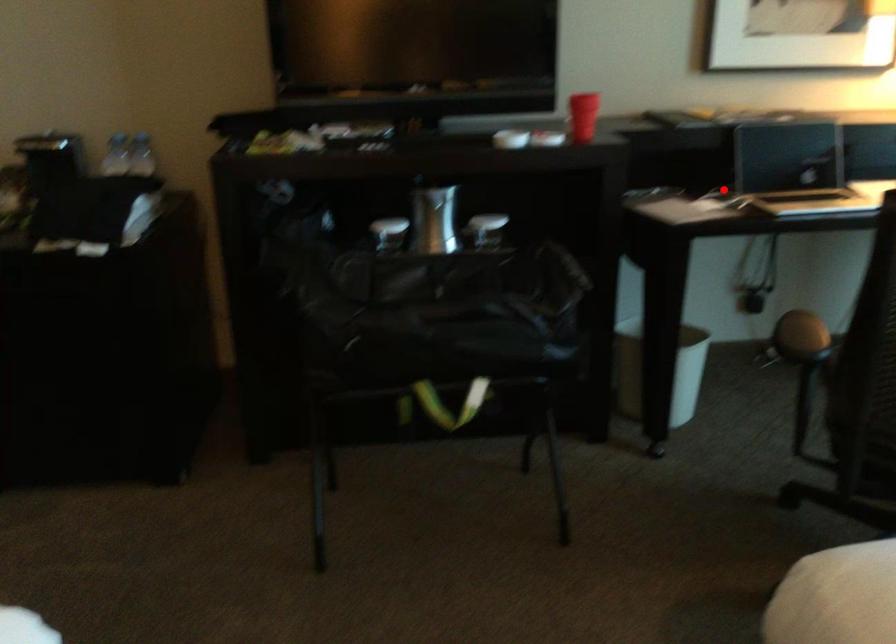
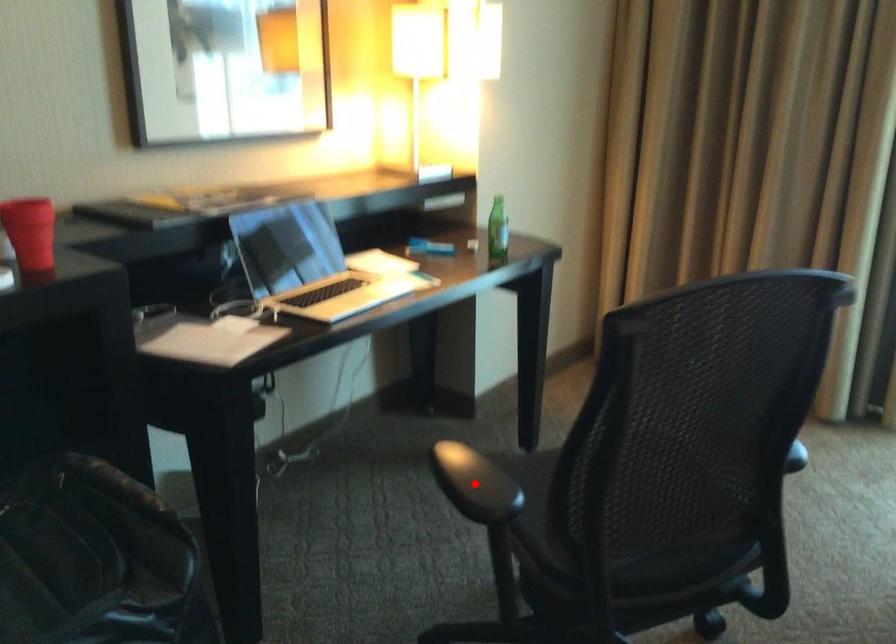
I am providing you with two images of the same scene from different viewpoints. A red point is marked on the first image and another point is marked on the second image. Is the red point in image1 aligned with the point shown in image2?

No